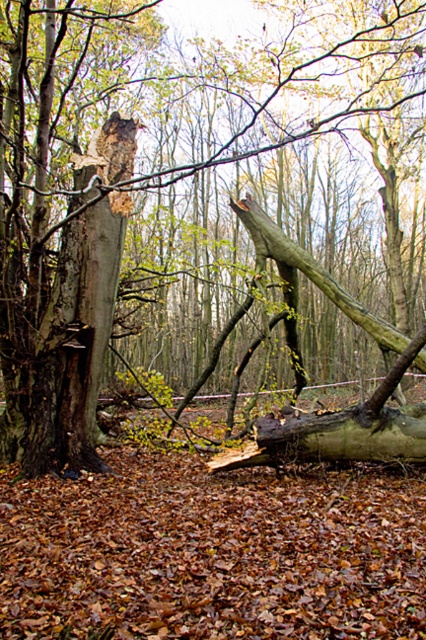
You are a hiker who wants to take a shortcut through the forest. You see the smooth bark tree at center and the smooth brown tree trunk at left. Which one do you need to walk around to reach the other side?

You need to walk around the smooth bark tree at center because it is in front of the smooth brown tree trunk at left, blocking your path.

You are standing in the forest scene and want to place a small marker at the closest point between point (36, 410) and point (127, 198). Which point should you choose?

Point (36, 410) is closer to the viewer than point (127, 198), so you should place the marker at point (36, 410).

You are a hiker who wants to climb the tallest tree in the forest. Based on the scene, which tree should you choose between the smooth bark tree at center and the smooth brown tree trunk at left?

The smooth bark tree at center is taller than the smooth brown tree trunk at left, so you should choose the smooth bark tree at center to climb.